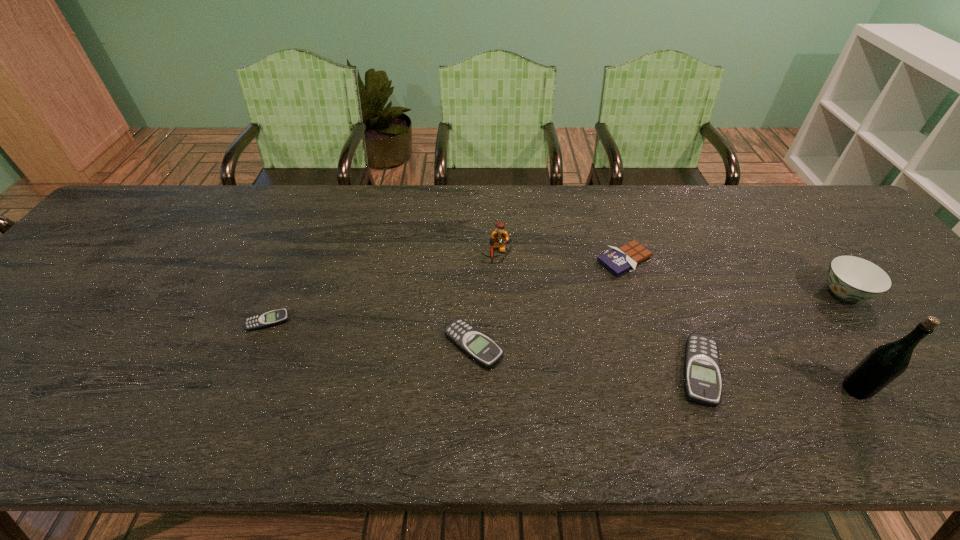
Where is `the leftmost beeper`? the leftmost beeper is located at coordinates (268, 319).

This screenshot has width=960, height=540. In order to click on the shortest beeper in this screenshot , I will do `click(268, 319)`.

Where is `the second beeper from left to right`? the second beeper from left to right is located at coordinates (474, 343).

You are a GUI agent. You are given a task and a screenshot of the screen. Output one action in this format:
    pyautogui.click(x=<x>, y=<y>)
    Task: Click on the rightmost beeper
    
    Given the screenshot: What is the action you would take?
    pyautogui.click(x=702, y=370)

Find the location of a particular element. the second tallest object is located at coordinates (500, 237).

Find the location of a particular element. The image size is (960, 540). soup bowl is located at coordinates (850, 278).

Find the location of `the rightmost object`. the rightmost object is located at coordinates (850, 278).

Where is `chocolate bar`? chocolate bar is located at coordinates (618, 260).

Where is `beer bottle`? beer bottle is located at coordinates (881, 366).

Identify the location of the tallest object. The width and height of the screenshot is (960, 540). (881, 366).